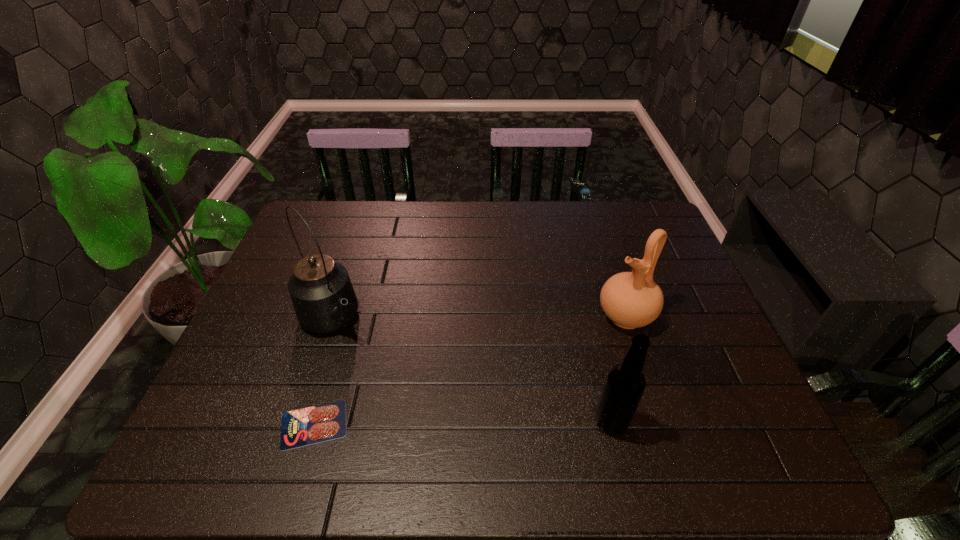
Identify the location of vacant space located on the spout of the pottery. The image size is (960, 540). (584, 343).

The width and height of the screenshot is (960, 540). I want to click on blank space located on the spout of the pottery, so click(552, 364).

Find the location of `salami that is at the near edge`. salami that is at the near edge is located at coordinates (325, 422).

Where is `beer bottle that is positioned at the near edge`? Image resolution: width=960 pixels, height=540 pixels. beer bottle that is positioned at the near edge is located at coordinates (625, 383).

Where is `object located at the left edge`? object located at the left edge is located at coordinates (324, 300).

Locate an element on the screen. object that is at the right edge is located at coordinates (630, 300).

The image size is (960, 540). I want to click on free location at the far edge, so click(356, 220).

What are the coordinates of `vacant space at the near edge of the desktop` in the screenshot? It's located at (494, 396).

The width and height of the screenshot is (960, 540). Identify the location of free location at the far left corner of the desktop. (331, 227).

Identify the location of free space at the near left corner of the desktop. This screenshot has width=960, height=540. click(x=204, y=404).